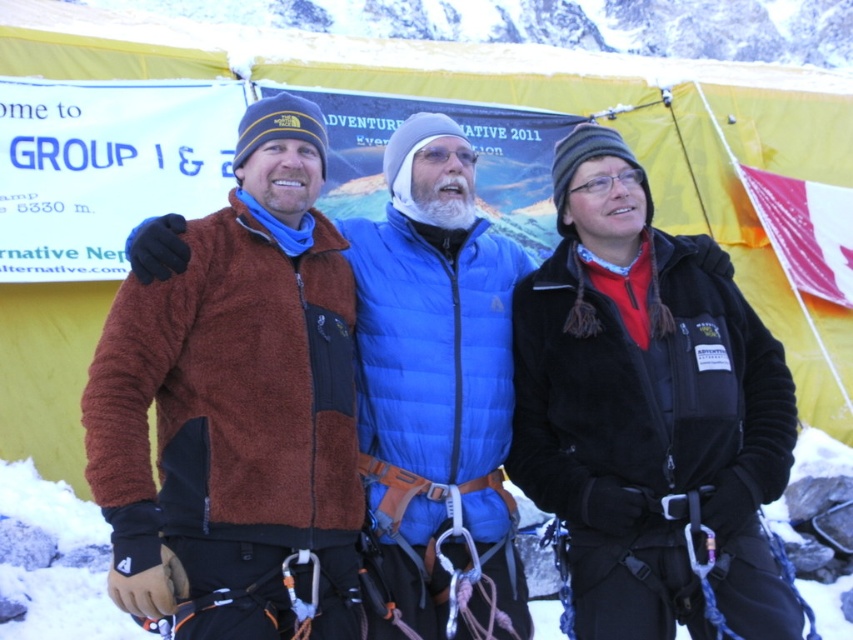
Question: Which point is farther from the camera taking this photo?

Choices:
 (A) (585, 529)
 (B) (460, 637)

Answer: (A)

Question: Is brown fleece jacket at center thinner than blue down vest at center?

Choices:
 (A) yes
 (B) no

Answer: (B)

Question: Based on their relative distances, which object is nearer to the blue down vest at center?

Choices:
 (A) black fleece jacket at center
 (B) brown fleece jacket at center

Answer: (B)

Question: Observing the image, what is the correct spatial positioning of brown fleece jacket at center in reference to blue down vest at center?

Choices:
 (A) above
 (B) below

Answer: (B)

Question: Which point appears farthest from the camera in this image?

Choices:
 (A) (576, 387)
 (B) (637, 422)

Answer: (A)

Question: Can you confirm if black fleece jacket at center is positioned below blue down vest at center?

Choices:
 (A) no
 (B) yes

Answer: (B)